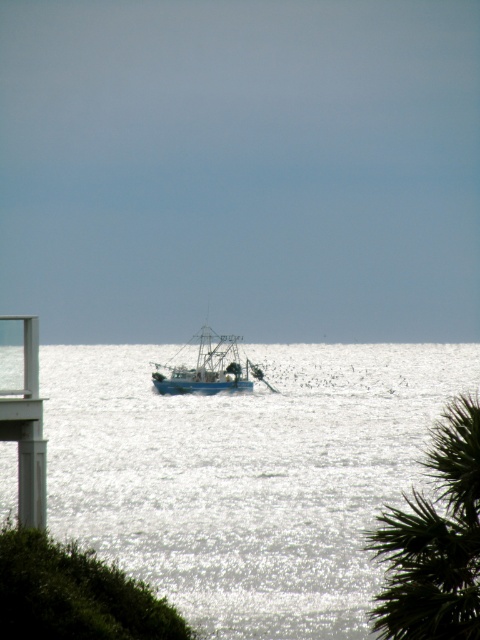
Question: Which point appears farthest from the camera in this image?

Choices:
 (A) (403, 636)
 (B) (410, 458)

Answer: (B)

Question: Is glistening silver water at center further to the viewer compared to blue matte fishing boat at center?

Choices:
 (A) no
 (B) yes

Answer: (A)

Question: Considering the relative positions of glistening silver water at center and green leafy palm tree at lower right in the image provided, where is glistening silver water at center located with respect to green leafy palm tree at lower right?

Choices:
 (A) left
 (B) right

Answer: (A)

Question: Which point is closer to the camera?

Choices:
 (A) (286, 632)
 (B) (465, 513)
 (C) (184, 387)

Answer: (B)

Question: Can you confirm if glistening silver water at center is positioned to the left of blue matte fishing boat at center?

Choices:
 (A) no
 (B) yes

Answer: (A)

Question: Which object appears closest to the camera in this image?

Choices:
 (A) green leafy palm tree at lower right
 (B) blue matte fishing boat at center
 (C) glistening silver water at center

Answer: (A)